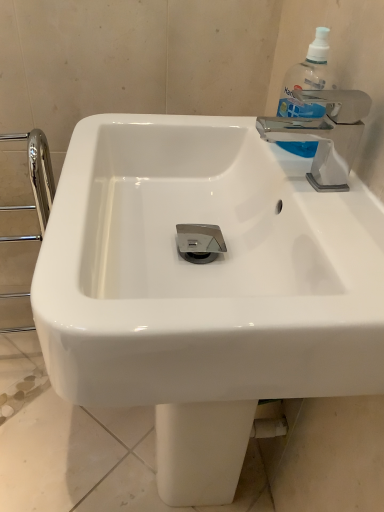
Locate an element on the screen. transparent plastic bottle at upper right is located at coordinates (308, 79).

This screenshot has width=384, height=512. Describe the element at coordinates (308, 79) in the screenshot. I see `transparent plastic bottle at upper right` at that location.

Identify the location of transparent plastic bottle at upper right. (308, 79).